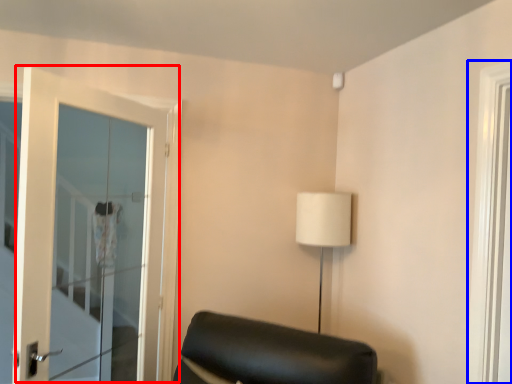
Question: Which object is further to the camera taking this photo, door (highlighted by a red box) or window (highlighted by a blue box)?

Choices:
 (A) door
 (B) window

Answer: (A)